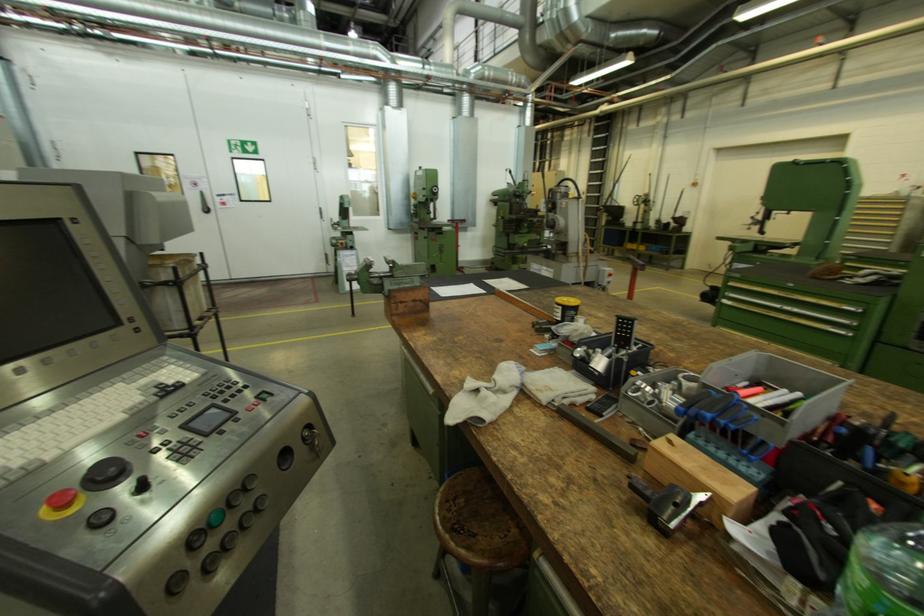
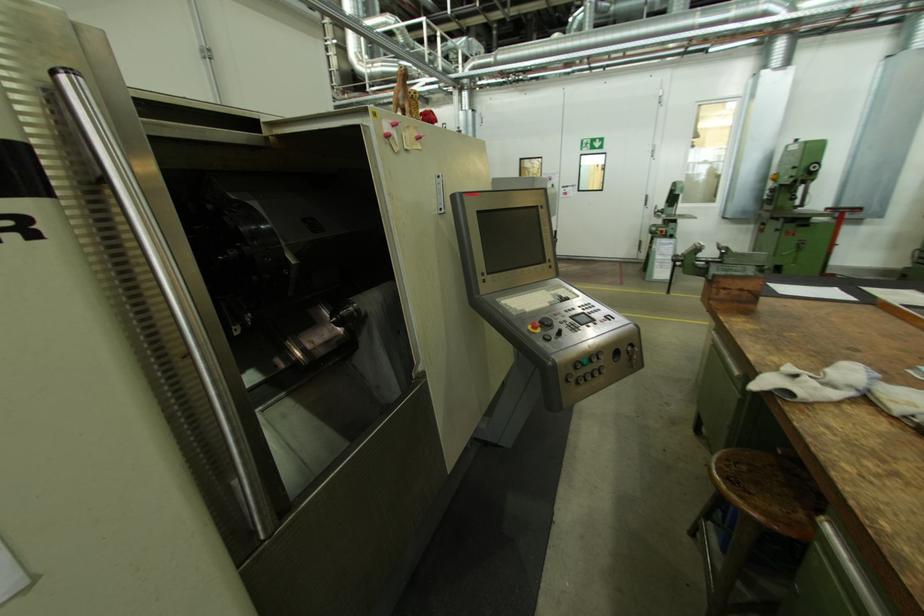
Where in the second image is the point corresponding to [479,537] from the first image?

(755, 493)